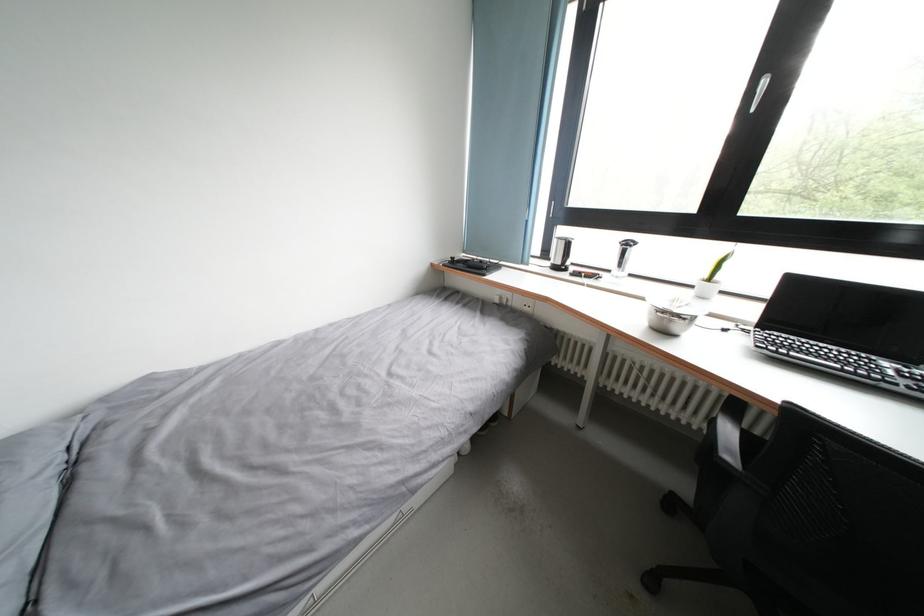
This screenshot has width=924, height=616. I want to click on black chair armrest, so click(x=727, y=434).